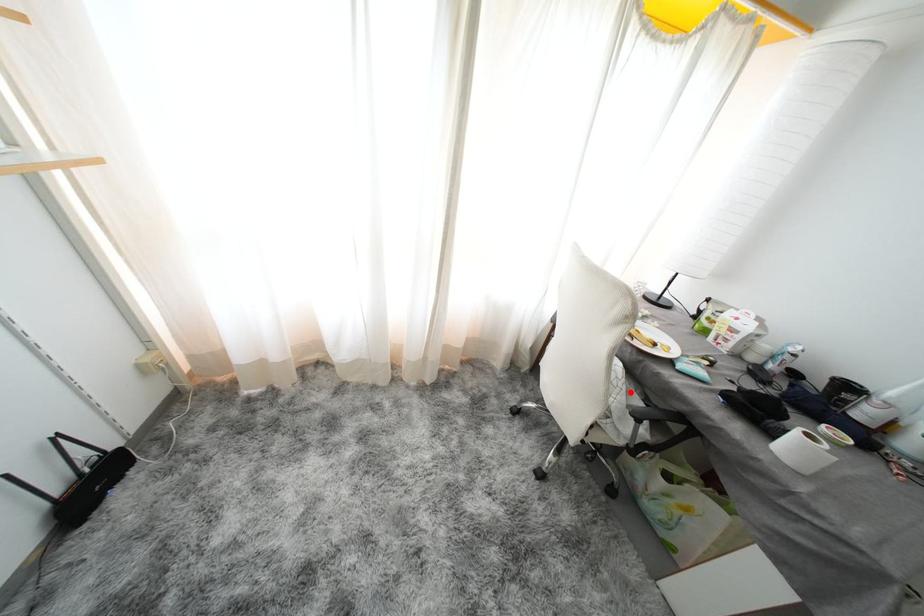
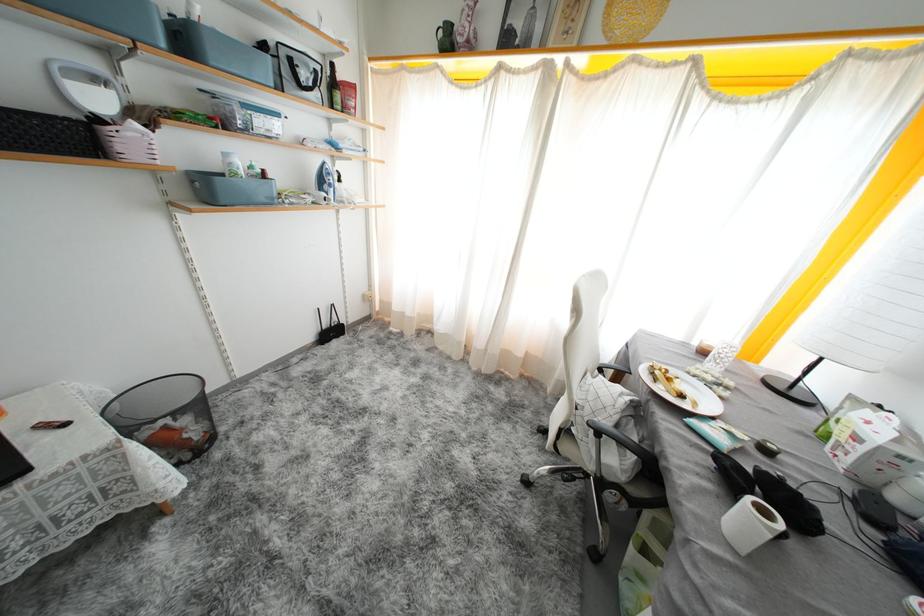
The point at the highlighted location is marked in the first image. Where is the corresponding point in the second image?

(623, 422)